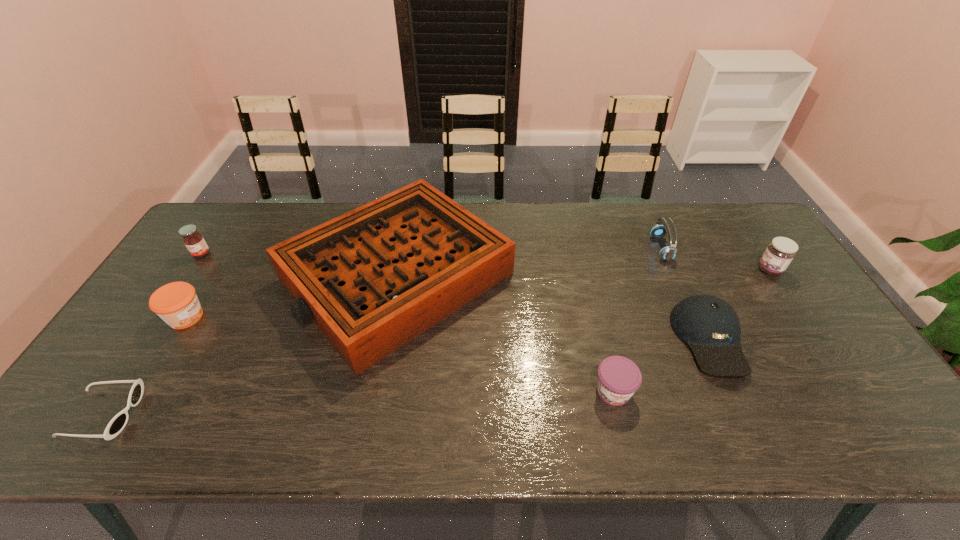
In order to click on gameboard in this screenshot , I will do `click(372, 279)`.

This screenshot has width=960, height=540. Identify the location of the rightmost jam. (780, 252).

Where is `the second farthest jam`? the second farthest jam is located at coordinates (780, 252).

Locate an element on the screen. Image resolution: width=960 pixels, height=540 pixels. headset is located at coordinates (668, 253).

Where is `the farthest jam`? The width and height of the screenshot is (960, 540). the farthest jam is located at coordinates (195, 243).

Locate an element on the screen. The image size is (960, 540). baseball cap is located at coordinates (710, 326).

Image resolution: width=960 pixels, height=540 pixels. In order to click on the third farthest jam in this screenshot , I will do `click(176, 303)`.

Where is `the third jam from left to right`? the third jam from left to right is located at coordinates (618, 378).

This screenshot has width=960, height=540. Identify the location of the fourth object from right to left. (618, 378).

Locate an element on the screen. sunglasses is located at coordinates (117, 424).